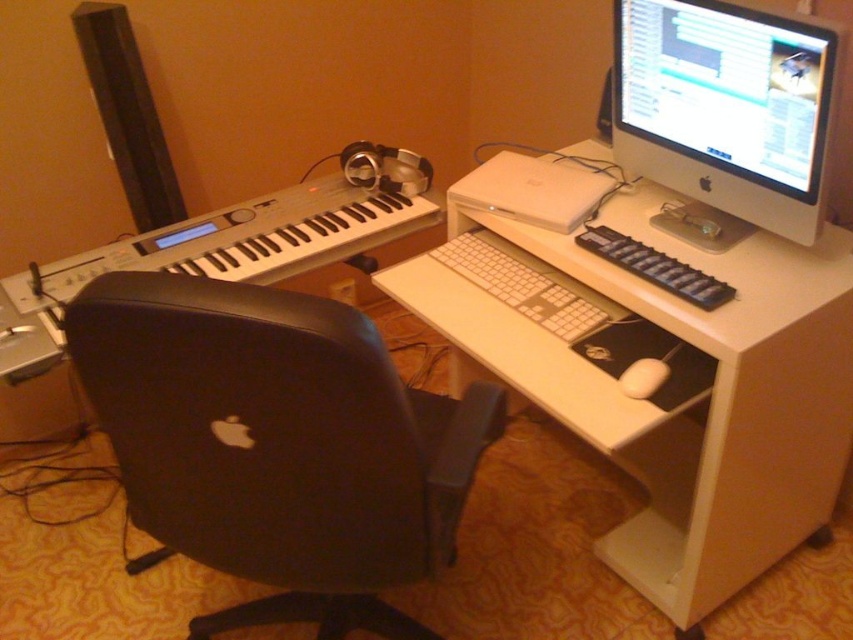
Is black matte keyboard at left above white plastic laptop at center?

No, black matte keyboard at left is not above white plastic laptop at center.

Is point (169, 264) farther from camera compared to point (509, 163)?

That is False.

This screenshot has width=853, height=640. Find the location of `black matte keyboard at left`. black matte keyboard at left is located at coordinates (225, 248).

Find the location of `white plastic computer desk at center`. white plastic computer desk at center is located at coordinates (683, 404).

Between white plastic computer desk at center and satin silver monitor at upper right, which one is positioned lower?

Positioned lower is white plastic computer desk at center.

Is point (761, 291) positioned before point (753, 92)?

No.

Where is `white plastic computer desk at center`? white plastic computer desk at center is located at coordinates (683, 404).

What do you see at coordinates (683, 404) in the screenshot? This screenshot has width=853, height=640. I see `white plastic computer desk at center` at bounding box center [683, 404].

Can you confirm if white plastic computer desk at center is bigger than white plastic laptop at center?

Yes, white plastic computer desk at center is bigger than white plastic laptop at center.

Between point (798, 289) and point (584, 204), which one is positioned behind?

Point (584, 204)

The width and height of the screenshot is (853, 640). Identify the location of white plastic computer desk at center. (683, 404).